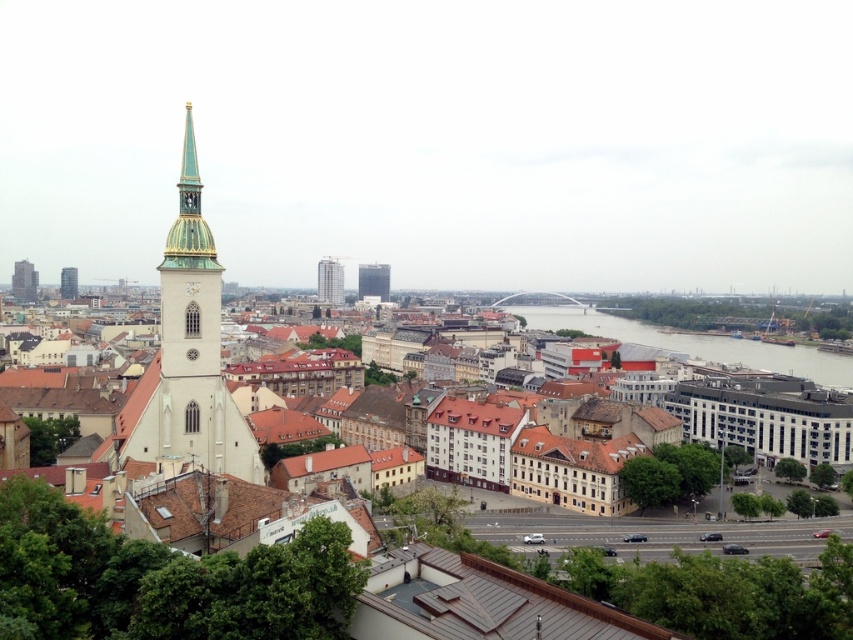
You are a tourist standing at the observation deck and want to take a photo of both the clear glass waterway at center and the dark gray glass tower at upper left. Which object should you focus on first to ensure both are in the frame?

You should focus on the clear glass waterway at center first because it is closer to the viewer than the dark gray glass tower at upper left, so adjusting the camera to include the closer object will help ensure the farther one is also in the frame.

You are a city planner reviewing this area and notice the clear glass waterway at center and the dark gray glass tower at upper left. Which of these two structures has a greater height?

The clear glass waterway at center is much taller than the dark gray glass tower at upper left, so the clear glass waterway at center has a greater height.